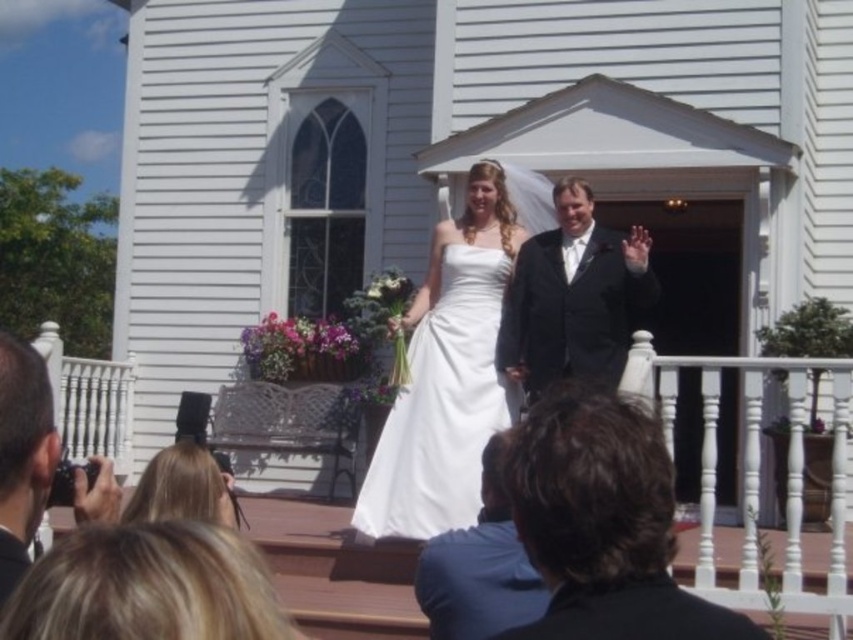
Does white wooden church at center appear on the right side of white satin dress at center?

No, white wooden church at center is not to the right of white satin dress at center.

Can you confirm if white wooden church at center is positioned above white satin dress at center?

Yes, white wooden church at center is above white satin dress at center.

Between point (323, 36) and point (375, 502), which one is positioned in front?

Point (375, 502)

Where is `white wooden church at center`? The image size is (853, 640). white wooden church at center is located at coordinates (468, 156).

Locate an element on the screen. Image resolution: width=853 pixels, height=640 pixels. blue fabric shirt at center is located at coordinates (480, 564).

Does white wooden church at center appear over white wooden porch at center?

Indeed, white wooden church at center is positioned over white wooden porch at center.

Which is more to the left, white wooden church at center or white wooden porch at center?

white wooden church at center

The image size is (853, 640). I want to click on white wooden church at center, so click(x=468, y=156).